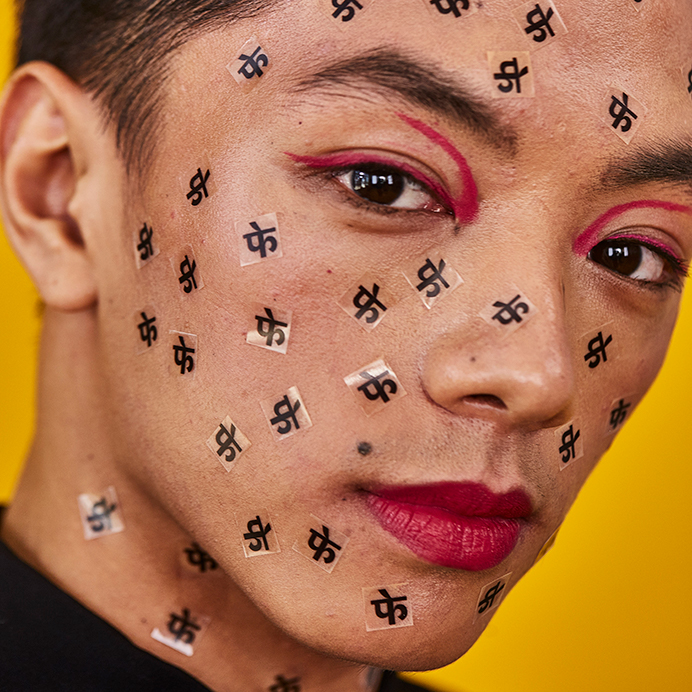
Identify the location of sticker. This screenshot has height=692, width=692. (507, 318).